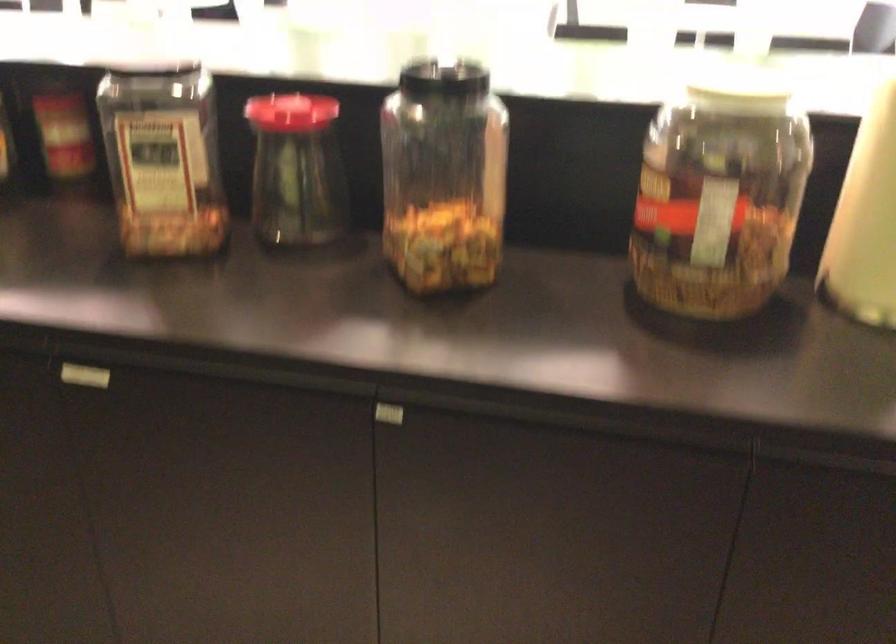
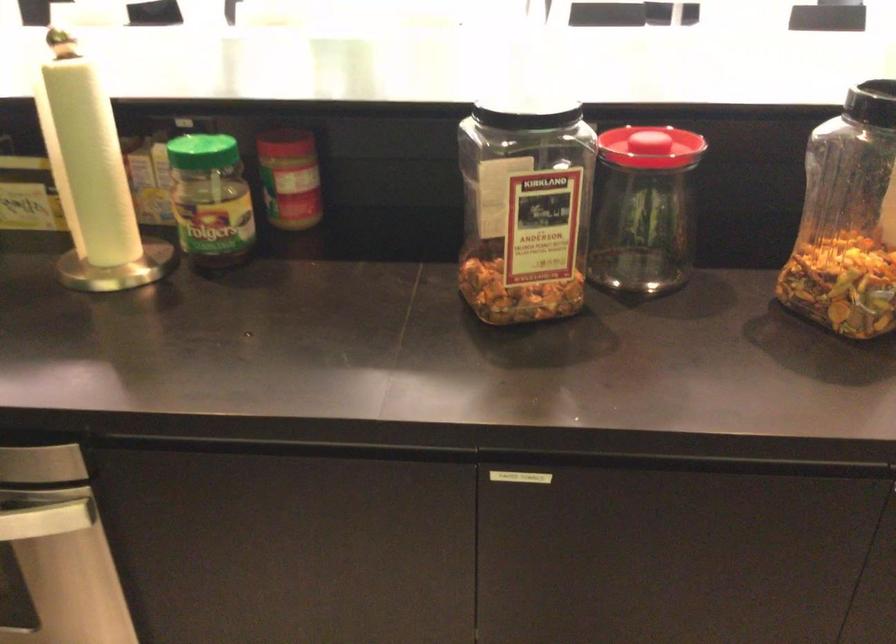
Question: What movement of the cameraman would produce the second image?

Choices:
 (A) Left
 (B) Right
 (C) Forward
 (D) Backward

Answer: (A)